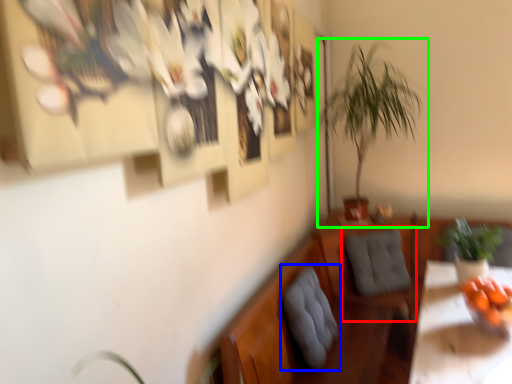
Question: Considering the real-world distances, which object is closest to swivel chair (highlighted by a red box)? swivel chair (highlighted by a blue box) or houseplant (highlighted by a green box).

Choices:
 (A) swivel chair
 (B) houseplant

Answer: (A)